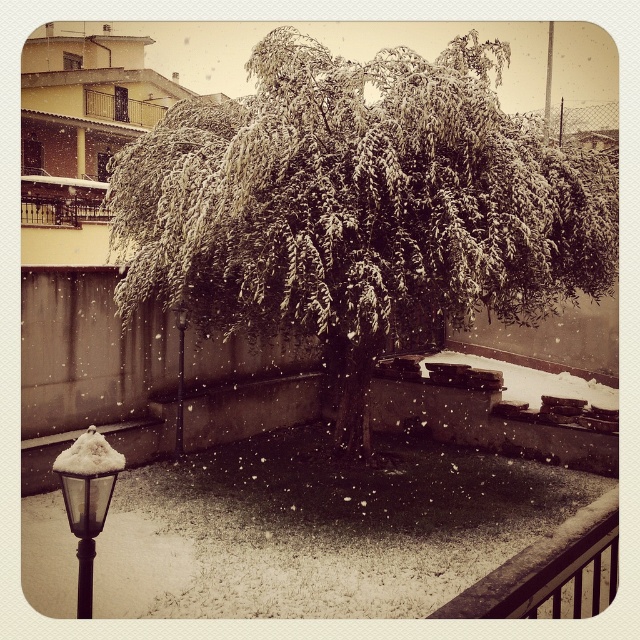
Who is positioned more to the left, matte black lamp post at lower left or white fluffy snow at lower left?

white fluffy snow at lower left is more to the left.

You are a GUI agent. You are given a task and a screenshot of the screen. Output one action in this format:
    pyautogui.click(x=<x>, y=<y>)
    Task: Click on the matte black lamp post at lower left
    The image size is (640, 640).
    Given the screenshot: What is the action you would take?
    pos(88,500)

How far apart are snow-covered leaves at center and white fluffy snow at lower left?

18.75 feet

Is snow-covered leaves at center taller than white fluffy snow at lower left?

Indeed, snow-covered leaves at center has a greater height compared to white fluffy snow at lower left.

This screenshot has width=640, height=640. I want to click on snow-covered leaves at center, so click(358, 205).

Does snow-covered leaves at center have a lesser height compared to matte black lamp post at lower left?

No, snow-covered leaves at center is not shorter than matte black lamp post at lower left.

Locate an element on the screen. snow-covered leaves at center is located at coordinates (358, 205).

Does point (465, 161) come farther from viewer compared to point (61, 484)?

Yes, point (465, 161) is behind point (61, 484).

Locate an element on the screen. snow-covered leaves at center is located at coordinates (358, 205).